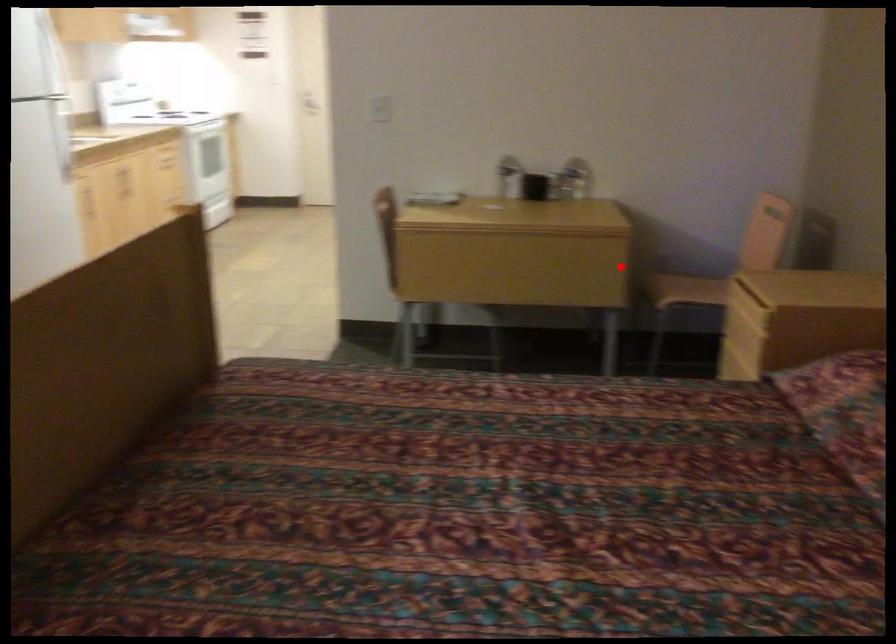
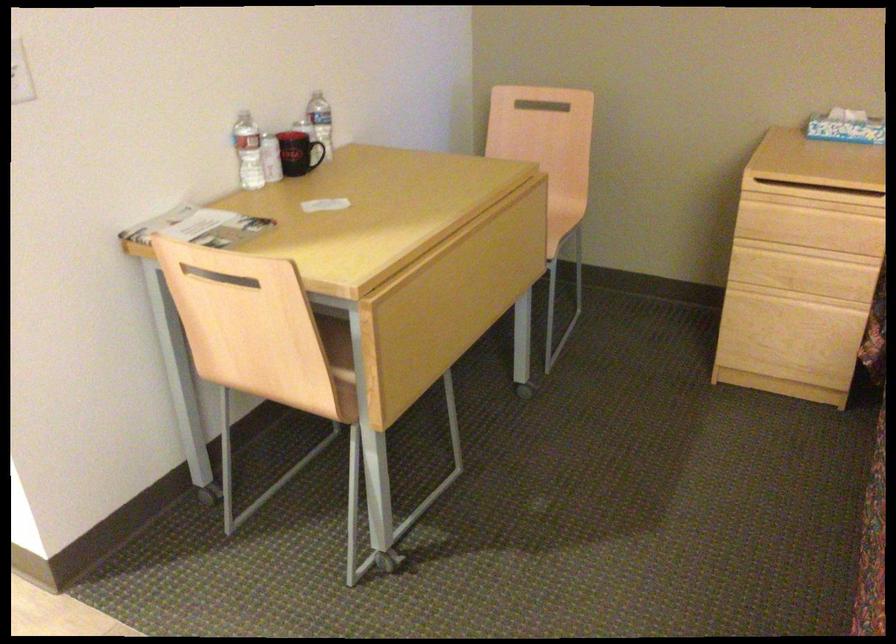
Question: A red point is marked in image1. In image2, is the corresponding 3D point closer to the camera or farther? Reply with the corresponding letter.

Choices:
 (A) The corresponding 3D point is closer.
 (B) The corresponding 3D point is farther.

Answer: (A)